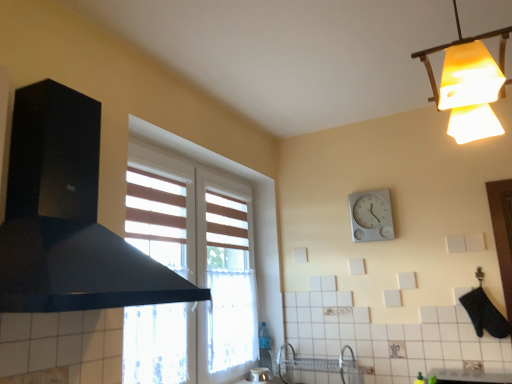
Question: Is yellow frosted glass lampshade at upper right closer to camera compared to white plastic wall clock at upper center?

Choices:
 (A) no
 (B) yes

Answer: (B)

Question: Can you confirm if yellow frosted glass lampshade at upper right is positioned to the right of white plastic wall clock at upper center?

Choices:
 (A) yes
 (B) no

Answer: (B)

Question: From a real-world perspective, is yellow frosted glass lampshade at upper right over white plastic wall clock at upper center?

Choices:
 (A) no
 (B) yes

Answer: (B)

Question: Is yellow frosted glass lampshade at upper right thinner than white plastic wall clock at upper center?

Choices:
 (A) no
 (B) yes

Answer: (A)

Question: Considering the relative positions of yellow frosted glass lampshade at upper right and white plastic wall clock at upper center in the image provided, is yellow frosted glass lampshade at upper right to the left of white plastic wall clock at upper center from the viewer's perspective?

Choices:
 (A) no
 (B) yes

Answer: (B)

Question: Is point (475, 379) closer or farther from the camera than point (350, 213)?

Choices:
 (A) closer
 (B) farther

Answer: (A)

Question: Considering the positions of white glossy countertop at lower center and white plastic wall clock at upper center in the image, is white glossy countertop at lower center bigger or smaller than white plastic wall clock at upper center?

Choices:
 (A) big
 (B) small

Answer: (A)

Question: In terms of width, does white glossy countertop at lower center look wider or thinner when compared to white plastic wall clock at upper center?

Choices:
 (A) wide
 (B) thin

Answer: (A)

Question: Is white glossy countertop at lower center inside or outside of white plastic wall clock at upper center?

Choices:
 (A) outside
 (B) inside

Answer: (A)

Question: Is point (104, 228) closer or farther from the camera than point (384, 192)?

Choices:
 (A) closer
 (B) farther

Answer: (A)

Question: From the image's perspective, relative to white plastic wall clock at upper center, is black matte exhaust hood at left above or below?

Choices:
 (A) above
 (B) below

Answer: (A)

Question: Is black matte exhaust hood at left spatially inside white plastic wall clock at upper center, or outside of it?

Choices:
 (A) inside
 (B) outside

Answer: (B)

Question: Considering their positions, is black matte exhaust hood at left located in front of or behind white plastic wall clock at upper center?

Choices:
 (A) front
 (B) behind

Answer: (A)

Question: From their relative heights in the image, would you say yellow frosted glass lampshade at upper right is taller or shorter than white plastic wall clock at upper center?

Choices:
 (A) tall
 (B) short

Answer: (A)

Question: Visually, is yellow frosted glass lampshade at upper right positioned to the left or to the right of white plastic wall clock at upper center?

Choices:
 (A) left
 (B) right

Answer: (A)